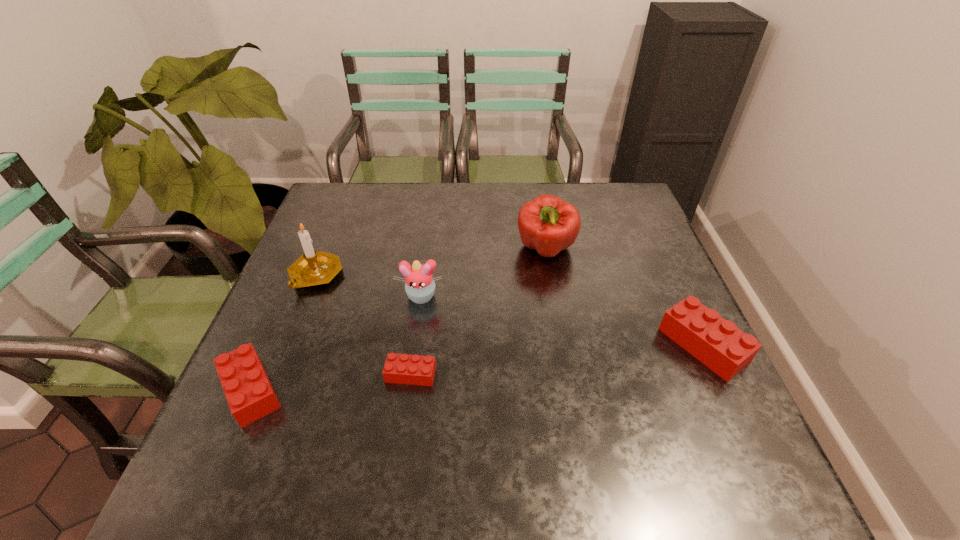
You are a GUI agent. You are given a task and a screenshot of the screen. Output one action in this format:
    pyautogui.click(x=<x>, y=<y>)
    Task: Click on the vacant space located 0.180m on the left of the rightmost Lego
    This screenshot has height=540, width=960.
    Given the screenshot: What is the action you would take?
    pyautogui.click(x=584, y=345)

Where is `free space located 0.300m on the face of the third tallest object`? This screenshot has width=960, height=540. free space located 0.300m on the face of the third tallest object is located at coordinates (404, 421).

Where is `vacant point located on the back of the second object from right to left`? vacant point located on the back of the second object from right to left is located at coordinates (535, 185).

The height and width of the screenshot is (540, 960). What are the coordinates of `blank space located 0.230m on the right of the candle holder` in the screenshot? It's located at (431, 276).

At what (x,y) coordinates should I click in order to perform the action: click on object at the near edge. Please return your answer as a coordinate pair (x, y). Looking at the image, I should click on (250, 396).

You are a GUI agent. You are given a task and a screenshot of the screen. Output one action in this format:
    pyautogui.click(x=<x>, y=<y>)
    Task: Click on the Lego present at the left edge
    
    Given the screenshot: What is the action you would take?
    pyautogui.click(x=250, y=396)

In order to click on candle holder at the left edge in this screenshot , I will do `click(312, 268)`.

Where is `object present at the right edge`? This screenshot has height=540, width=960. object present at the right edge is located at coordinates (717, 343).

At what (x,y) coordinates should I click in order to perform the action: click on object located at the near left corner. Please return your answer as a coordinate pair (x, y). The image size is (960, 540). Looking at the image, I should click on (250, 396).

Image resolution: width=960 pixels, height=540 pixels. In the image, there is a desktop. What are the coordinates of `vacant space at the far edge` in the screenshot? It's located at [x=542, y=185].